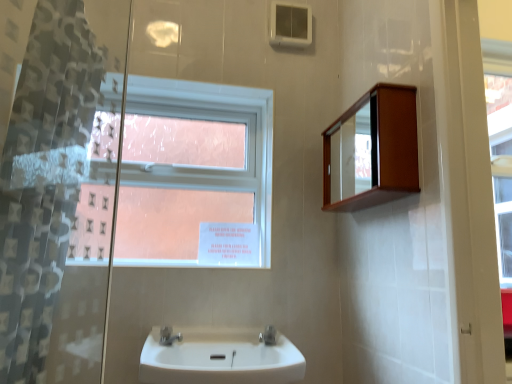
Question: Is white glossy sink at center not inside satin nickel faucet at lower center, arranged as the second tap when viewed from the right?

Choices:
 (A) no
 (B) yes

Answer: (B)

Question: Would you say white glossy sink at center is a long distance from satin nickel faucet at lower center, which is the 1th tap from left to right?

Choices:
 (A) yes
 (B) no

Answer: (B)

Question: Can you confirm if white glossy sink at center is bigger than satin nickel faucet at lower center, which is the 1th tap from left to right?

Choices:
 (A) no
 (B) yes

Answer: (B)

Question: Is white glossy sink at center turned away from satin nickel faucet at lower center, arranged as the second tap when viewed from the right?

Choices:
 (A) yes
 (B) no

Answer: (B)

Question: From a real-world perspective, does white glossy sink at center sit lower than satin nickel faucet at lower center, arranged as the second tap when viewed from the right?

Choices:
 (A) no
 (B) yes

Answer: (B)

Question: Is white glossy sink at center touching satin nickel faucet at lower center, arranged as the second tap when viewed from the right?

Choices:
 (A) no
 (B) yes

Answer: (A)

Question: Can you confirm if clear glass window at upper center is taller than satin nickel faucet at lower center, arranged as the second tap when viewed from the right?

Choices:
 (A) no
 (B) yes

Answer: (B)

Question: Is clear glass window at upper center bigger than satin nickel faucet at lower center, which is the 1th tap from left to right?

Choices:
 (A) yes
 (B) no

Answer: (A)

Question: Is satin nickel faucet at lower center, arranged as the second tap when viewed from the right, completely or partially inside clear glass window at upper center?

Choices:
 (A) yes
 (B) no

Answer: (B)

Question: Considering the relative positions of clear glass window at upper center and satin nickel faucet at lower center, which is the 1th tap from left to right, in the image provided, is clear glass window at upper center to the right of satin nickel faucet at lower center, which is the 1th tap from left to right, from the viewer's perspective?

Choices:
 (A) yes
 (B) no

Answer: (B)

Question: Is clear glass window at upper center positioned far away from satin nickel faucet at lower center, which is the 1th tap from left to right?

Choices:
 (A) yes
 (B) no

Answer: (B)

Question: Is clear glass window at upper center wider than satin nickel faucet at lower center, arranged as the second tap when viewed from the right?

Choices:
 (A) yes
 (B) no

Answer: (B)

Question: Is satin nickel faucet at sink center, which is counted as the first tap, starting from the right, shorter than translucent plastic shower curtain at left?

Choices:
 (A) no
 (B) yes

Answer: (B)